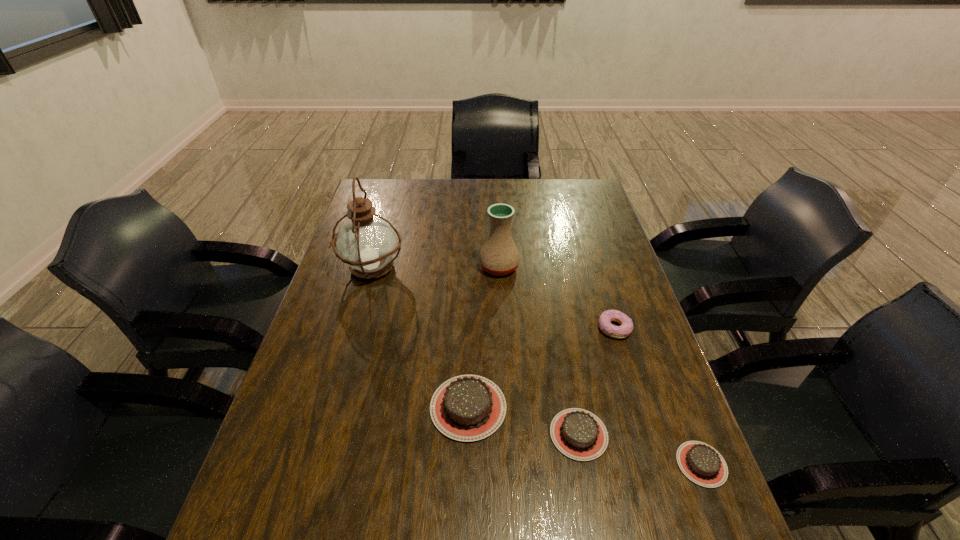
You are a GUI agent. You are given a task and a screenshot of the screen. Output one action in this format:
    pyautogui.click(x=<x>, y=<y>)
    Task: Click on the chocolate cake object that ranks as the second closest to the fourth nearest object
    This screenshot has height=540, width=960.
    Given the screenshot: What is the action you would take?
    pyautogui.click(x=466, y=408)

What are the coordinates of `free space that satisfies the following two spatial constraints: 1. on the back side of the leftmost chocolate cake; 2. on the left side of the doughnut` in the screenshot? It's located at (470, 328).

Where is `free space that satisfies the following two spatial constraints: 1. on the back side of the second tallest chocolate cake; 2. on the left side of the doughnut`? This screenshot has height=540, width=960. free space that satisfies the following two spatial constraints: 1. on the back side of the second tallest chocolate cake; 2. on the left side of the doughnut is located at coordinates [560, 328].